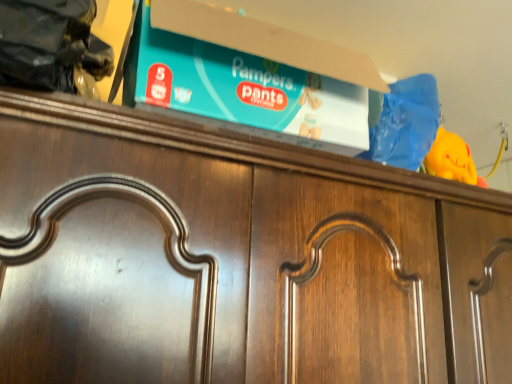
Image resolution: width=512 pixels, height=384 pixels. Identify the location of blue cardboard box at upper center. [x=243, y=90].

Describe the element at coordinates (243, 90) in the screenshot. I see `blue cardboard box at upper center` at that location.

What is the approximate height of blue cardboard box at upper center?

It is 7.13 inches.

Identify the location of blue cardboard box at upper center. This screenshot has height=384, width=512. (243, 90).